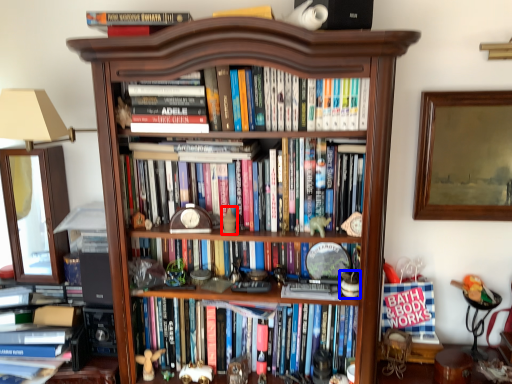
Question: Which point is closer to the camera, toy (highlighted by a red box) or toy (highlighted by a blue box)?

Choices:
 (A) toy
 (B) toy

Answer: (B)